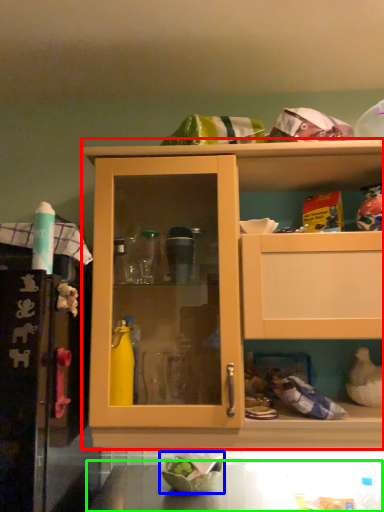
Question: Which is farther away from cabinetry (highlighted by a red box)? bowl (highlighted by a blue box) or counter top (highlighted by a green box)?

Choices:
 (A) bowl
 (B) counter top

Answer: (A)